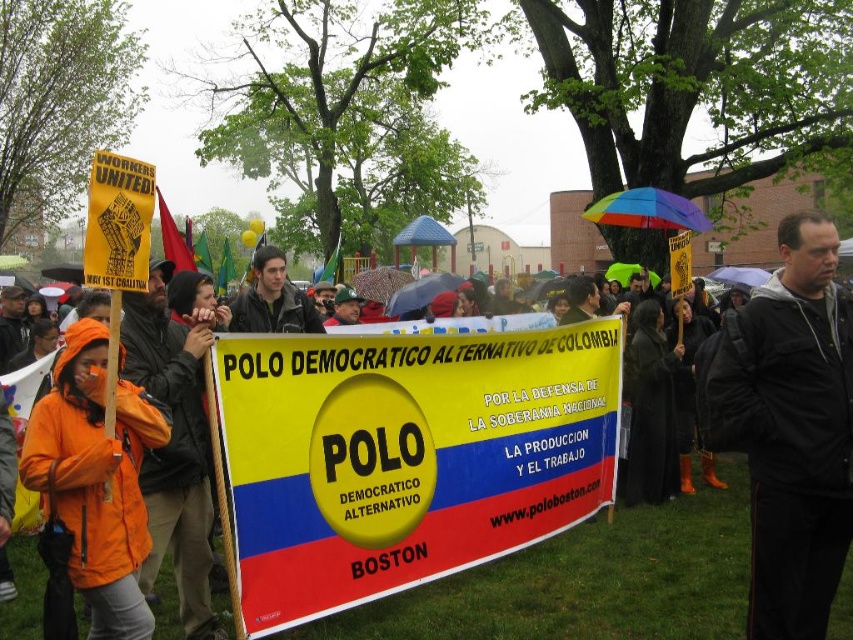
You are a photographer standing at the camera position. You want to take a closeup shot of the yellow fabric banner at center. Given that your camera can focus on objects within 10 feet, will you be able to capture a clear closeup without moving closer?

The yellow fabric banner at center is 15.79 feet away from the camera, which is beyond the 10 feet focusing range. Therefore, you cannot capture a clear closeup without moving closer.

In the scene shown: You are a photographer at the protest and want to capture a photo that includes both the yellow fabric banner at center and the black jacket at center. Based on their positions, which object should you position closer to the bottom of the frame to ensure both are visible?

The yellow fabric banner at center is below the black jacket at center, so to include both in the photo, position the yellow fabric banner at center closer to the bottom of the frame since it is already lower than the black jacket at center.

You are a photographer standing at the edge of the protest area. You want to capture a photo that includes both the black jacket at center and the orange waterproof jacket at left. Given that your camera has a maximum focus range of 3.5 meters, will you be able to include both subjects in the same frame without moving closer?

The distance between the black jacket at center and the orange waterproof jacket at left is 3.60 meters. Since your camera can only focus up to 3.5 meters, you will not be able to capture both subjects in the same frame clearly without moving closer.